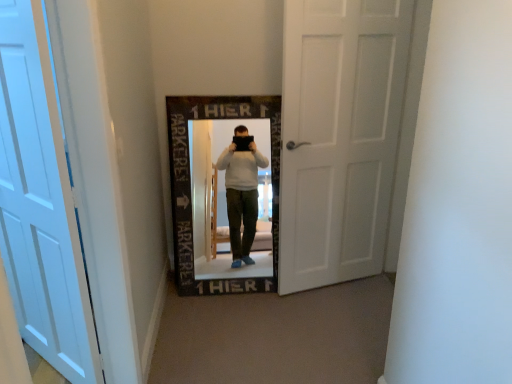
Question: From the image's perspective, is white matte door at center, which appears as the 1th door when viewed from the back, above white matte door at left, which is counted as the first door, starting from the left?

Choices:
 (A) yes
 (B) no

Answer: (A)

Question: Is white matte door at center, the 2th door when ordered from front to back, bigger than white matte door at left, placed as the 2th door when sorted from back to front?

Choices:
 (A) yes
 (B) no

Answer: (A)

Question: Is white matte door at center, which appears as the 1th door when viewed from the back, further to the viewer compared to white matte door at left, placed as the 2th door when sorted from back to front?

Choices:
 (A) no
 (B) yes

Answer: (B)

Question: Can you confirm if white matte door at center, the 2th door when ordered from front to back, is positioned to the right of white matte door at left, which is counted as the first door, starting from the left?

Choices:
 (A) no
 (B) yes

Answer: (B)

Question: Is white matte door at center, the second door viewed from the left, looking in the opposite direction of white matte door at left, marked as the 1th door in a front-to-back arrangement?

Choices:
 (A) yes
 (B) no

Answer: (B)

Question: Are white matte door at center, the 2th door when ordered from front to back, and white matte door at left, marked as the 1th door in a front-to-back arrangement, far apart?

Choices:
 (A) no
 (B) yes

Answer: (B)

Question: Is the depth of white matte door at left, which is counted as the first door, starting from the left, greater than that of white matte door at center, the second door viewed from the left?

Choices:
 (A) no
 (B) yes

Answer: (A)

Question: Does white matte door at left, which is counted as the first door, starting from the left, have a greater width compared to white matte door at center, the second door viewed from the left?

Choices:
 (A) no
 (B) yes

Answer: (B)

Question: From a real-world perspective, is white matte door at left, which is counted as the first door, starting from the left, on top of white matte door at center, the second door viewed from the left?

Choices:
 (A) no
 (B) yes

Answer: (A)

Question: Is white matte door at left, marked as the 1th door in a front-to-back arrangement, to the left of white matte door at center, the second door viewed from the left, from the viewer's perspective?

Choices:
 (A) no
 (B) yes

Answer: (B)

Question: Considering the relative sizes of white matte door at left, which appears as the second door when viewed from the right, and white matte door at center, the 2th door when ordered from front to back, in the image provided, is white matte door at left, which appears as the second door when viewed from the right, bigger than white matte door at center, the 2th door when ordered from front to back,?

Choices:
 (A) yes
 (B) no

Answer: (B)

Question: Considering the positions of white matte door at left, marked as the 1th door in a front-to-back arrangement, and white matte door at center, the 2th door when ordered from front to back, in the image, is white matte door at left, marked as the 1th door in a front-to-back arrangement, wider or thinner than white matte door at center, the 2th door when ordered from front to back,?

Choices:
 (A) wide
 (B) thin

Answer: (A)